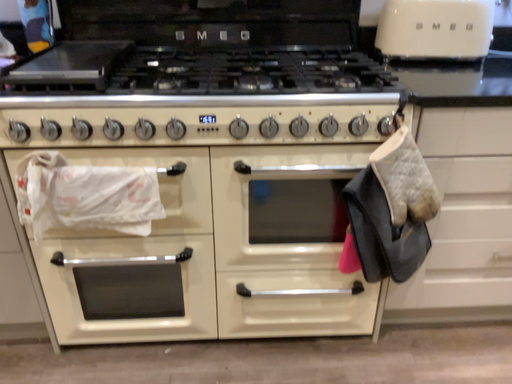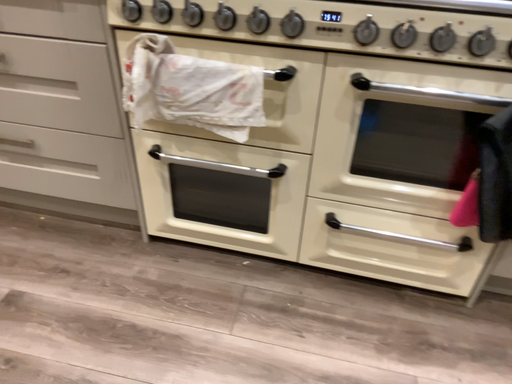
Question: How did the camera likely rotate when shooting the video?

Choices:
 (A) rotated downward
 (B) rotated upward

Answer: (A)